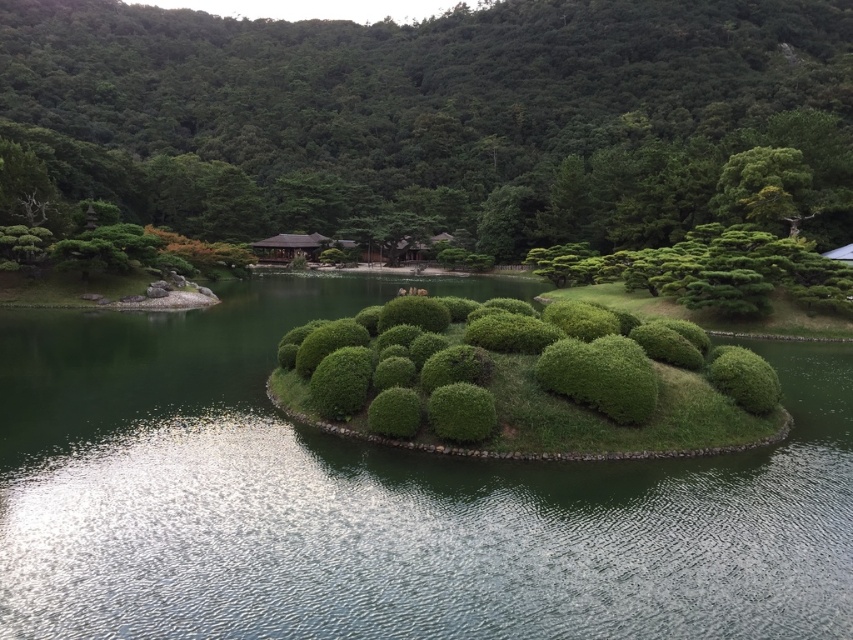
Question: Considering the real-world distances, which object is closest to the green leafy bush at center?

Choices:
 (A) green grassy island at center
 (B) green bushy hedge at center

Answer: (B)

Question: Which point is closer to the camera?

Choices:
 (A) pos(569,394)
 (B) pos(155,420)

Answer: (A)

Question: From the image, what is the correct spatial relationship of green grassy island at center in relation to green bushy hedge at center?

Choices:
 (A) left
 (B) right

Answer: (A)

Question: Among these points, which one is nearest to the camera?

Choices:
 (A) (436, 33)
 (B) (811, 464)
 (C) (676, 410)

Answer: (B)

Question: Can you confirm if green grassy island at center is thinner than green bushy hedge at center?

Choices:
 (A) yes
 (B) no

Answer: (B)

Question: Can you confirm if green leafy bush at center is thinner than green bushy hedge at center?

Choices:
 (A) no
 (B) yes

Answer: (A)